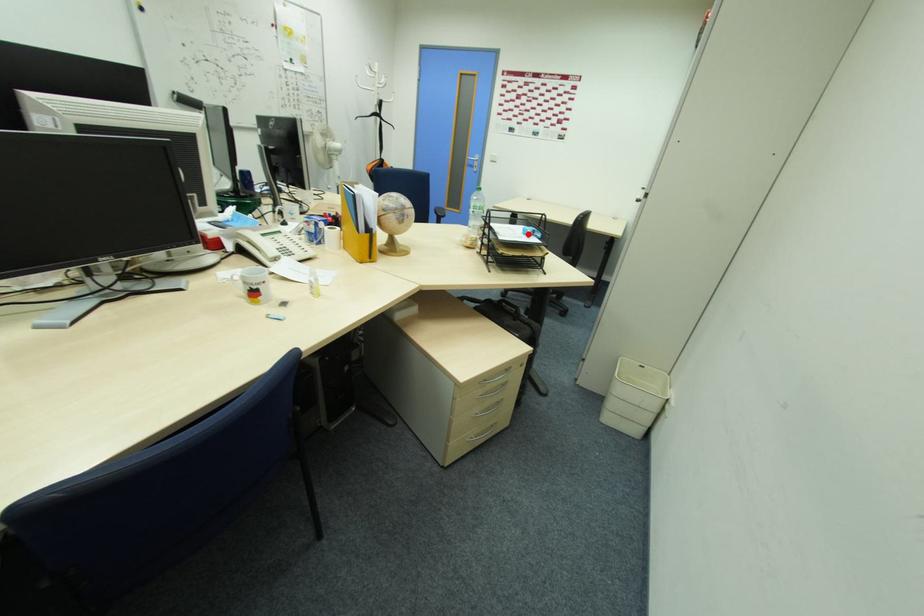
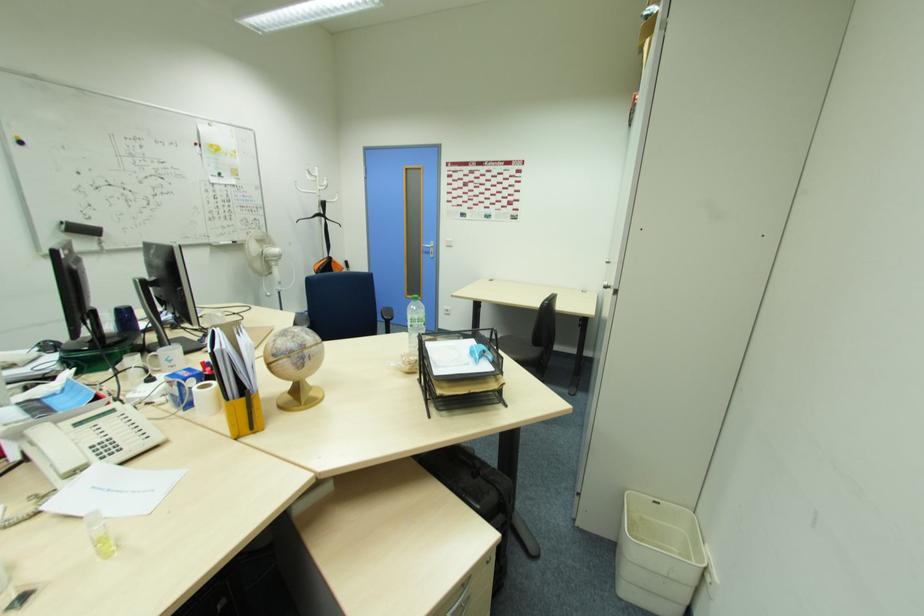
The point at the highlighted location is marked in the first image. Where is the corresponding point in the second image?

(476, 354)